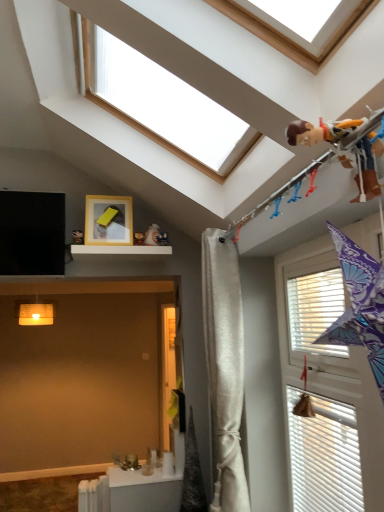
Question: Considering the positions of white wood window at upper center, which is the 2th window from right to left, and white silky curtain at center in the image, is white wood window at upper center, which is the 2th window from right to left, taller or shorter than white silky curtain at center?

Choices:
 (A) tall
 (B) short

Answer: (B)

Question: Is point (175, 98) closer or farther from the camera than point (223, 435)?

Choices:
 (A) farther
 (B) closer

Answer: (B)

Question: Which object is the farthest from the white textured window at right, which ranks as the 1th window in bottom-to-top order?

Choices:
 (A) white silky curtain at center
 (B) white matte shelf at upper center
 (C) matte yellow picture frame at upper center
 (D) brown fabric toy at upper right
 (E) white wood window at upper center, acting as the 1th window starting from the left

Answer: (C)

Question: Estimate the real-world distances between objects in this image. Which object is closer to the brown fabric toy at upper right?

Choices:
 (A) matte yellow picture frame at upper center
 (B) white metallic radiator at lower left
 (C) black matte screen at upper left
 (D) white matte shelf at upper center
 (E) white wood window at upper center, the 2th window ordered from the bottom

Answer: (E)